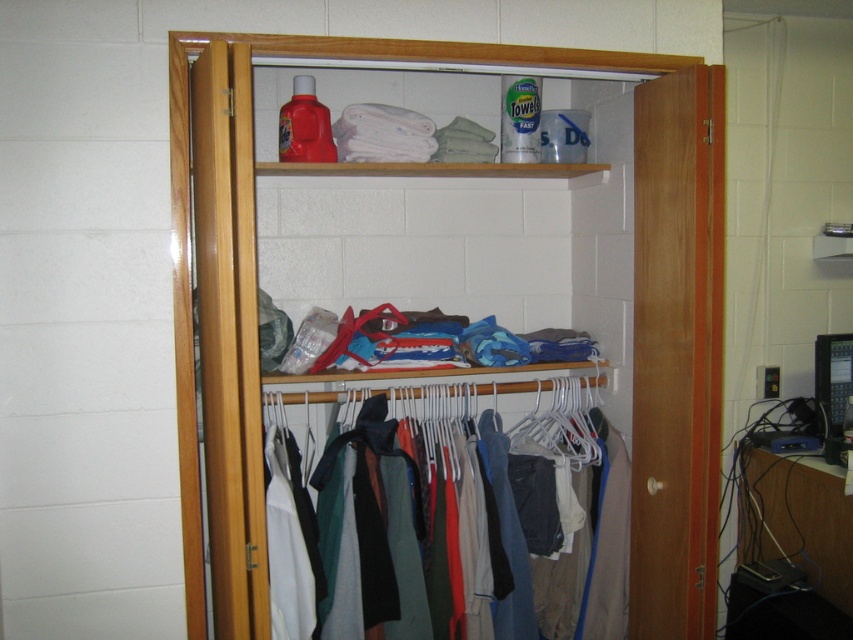
Between point (654, 100) and point (467, 488), which one is positioned behind?

Point (467, 488)

In order to click on wooden hangers at center in this screenshot , I will do `click(631, 298)`.